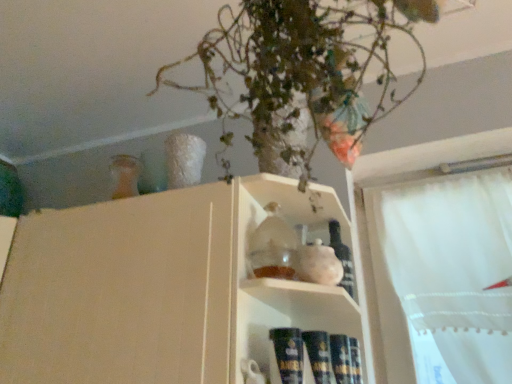
The width and height of the screenshot is (512, 384). I want to click on translucent glass bottle at shelf center, so click(x=343, y=258).

At what (x,y) coordinates should I click in order to perform the action: click on green leafy plant at upper center. Please return your answer as a coordinate pair (x, y). Looking at the image, I should click on (302, 72).

This screenshot has width=512, height=384. What do you see at coordinates (160, 288) in the screenshot?
I see `matte glass jar at center` at bounding box center [160, 288].

Locate an element on the screen. This screenshot has height=384, width=512. translucent glass bottle at shelf center is located at coordinates (343, 258).

From a real-world perspective, who is located lower, translucent glass bottle at shelf center or matte glass jar at center?

From a 3D spatial view, matte glass jar at center is below.

Looking at this image, who is taller, translucent glass bottle at shelf center or matte glass jar at center?

matte glass jar at center.

Does point (339, 283) appear closer or farther from the camera than point (93, 327)?

Point (339, 283) appears to be farther away from the viewer than point (93, 327).

Is the depth of translucent glass bottle at shelf center less than that of green leafy plant at upper center?

No, it is not.

Considering the relative sizes of translucent glass bottle at shelf center and green leafy plant at upper center in the image provided, is translucent glass bottle at shelf center bigger than green leafy plant at upper center?

Incorrect, translucent glass bottle at shelf center is not larger than green leafy plant at upper center.

Based on the photo, choose the correct answer: Is translucent glass bottle at shelf center inside green leafy plant at upper center or outside it?

The correct answer is: outside.

Which is closer to the camera, (354, 278) or (210, 42)?

Point (354, 278).

Can you confirm if green leafy plant at upper center is positioned to the left of translucent glass bottle at shelf center?

Correct, you'll find green leafy plant at upper center to the left of translucent glass bottle at shelf center.

Looking at this image, from a real-world perspective, which object rests below the other?

translucent glass bottle at shelf center, from a real-world perspective.

Which is correct: green leafy plant at upper center is inside translucent glass bottle at shelf center, or outside of it?

The correct answer is: outside.

How distant is green leafy plant at upper center from translucent glass bottle at shelf center?

green leafy plant at upper center and translucent glass bottle at shelf center are 18.66 inches apart from each other.

Is green leafy plant at upper center at the back of matte glass jar at center?

That's not correct — matte glass jar at center is not looking away from green leafy plant at upper center.

Which is nearer, [199,362] or [298,132]?

Positioned in front is point [199,362].

From a real-world perspective, is matte glass jar at center physically above green leafy plant at upper center?

No.

In the scene shown: Is matte glass jar at center bigger or smaller than green leafy plant at upper center?

Considering their sizes, matte glass jar at center takes up more space than green leafy plant at upper center.

Is matte glass jar at center positioned beyond the bounds of translucent glass bottle at shelf center?

Yes, matte glass jar at center is outside of translucent glass bottle at shelf center.

Which of these two, matte glass jar at center or translucent glass bottle at shelf center, is thinner?

With smaller width is translucent glass bottle at shelf center.

In the image, is matte glass jar at center on the left side or the right side of translucent glass bottle at shelf center?

In the image, matte glass jar at center appears on the left side of translucent glass bottle at shelf center.

From the image's perspective, is green leafy plant at upper center beneath matte glass jar at center?

Incorrect, from the image's perspective, green leafy plant at upper center is higher than matte glass jar at center.

Is point (324, 73) positioned behind point (255, 280)?

That is False.

Considering the sizes of green leafy plant at upper center and matte glass jar at center in the image, is green leafy plant at upper center taller or shorter than matte glass jar at center?

Clearly, green leafy plant at upper center is shorter compared to matte glass jar at center.

From a real-world perspective, who is located lower, green leafy plant at upper center or matte glass jar at center?

matte glass jar at center, from a real-world perspective.

This screenshot has width=512, height=384. I want to click on shelf in front of the translucent glass bottle at shelf center, so click(160, 288).

Find the location of a particular element. houseplant above the translucent glass bottle at shelf center (from a real-world perspective) is located at coordinates (302, 72).

Which object lies nearer to the anchor point matte glass jar at center, green leafy plant at upper center or translucent glass bottle at shelf center?

green leafy plant at upper center is positioned closer to the anchor matte glass jar at center.

Based on their spatial positions, is translucent glass bottle at shelf center or matte glass jar at center closer to green leafy plant at upper center?

Based on the image, matte glass jar at center appears to be nearer to green leafy plant at upper center.

Based on their spatial positions, is matte glass jar at center or green leafy plant at upper center closer to translucent glass bottle at shelf center?

Based on the image, matte glass jar at center appears to be nearer to translucent glass bottle at shelf center.

Based on the photo, estimate the real-world distances between objects in this image. Which object is closer to matte glass jar at center, translucent glass bottle at shelf center or green leafy plant at upper center?

green leafy plant at upper center is positioned closer to the anchor matte glass jar at center.

Based on their spatial positions, is green leafy plant at upper center or matte glass jar at center further from translucent glass bottle at shelf center?

green leafy plant at upper center lies further to translucent glass bottle at shelf center than the other object.

From the image, which object appears to be nearer to green leafy plant at upper center, matte glass jar at center or translucent glass bottle at shelf center?

matte glass jar at center.

Find the location of `bottle between green leafy plant at upper center and matte glass jar at center in the up-down direction`. bottle between green leafy plant at upper center and matte glass jar at center in the up-down direction is located at coordinates (343, 258).